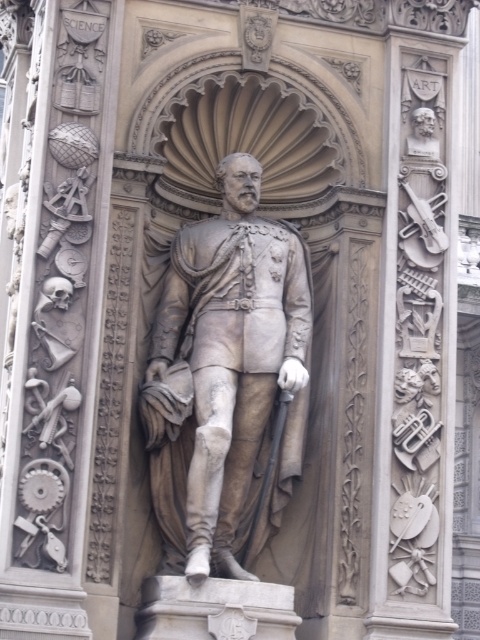
Can you confirm if gray stone statue at center is wider than gray stone bust at upper right?

Yes, gray stone statue at center is wider than gray stone bust at upper right.

Is point (228, 442) positioned in front of point (417, 128)?

Yes.

Find the location of a particular element. gray stone statue at center is located at coordinates (224, 369).